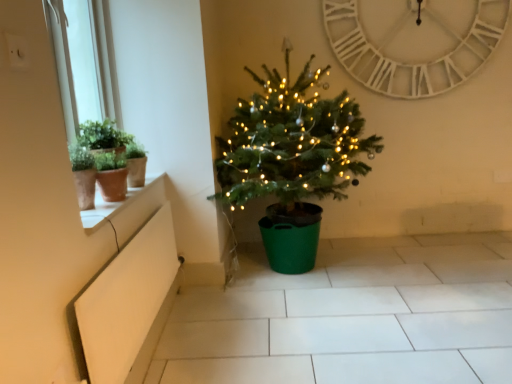
Question: Considering the relative sizes of green matte christmas tree at center and white glossy window sill at upper left in the image provided, is green matte christmas tree at center smaller than white glossy window sill at upper left?

Choices:
 (A) yes
 (B) no

Answer: (B)

Question: Does green matte christmas tree at center have a greater height compared to white glossy window sill at upper left?

Choices:
 (A) yes
 (B) no

Answer: (A)

Question: Is green matte christmas tree at center oriented towards white glossy window sill at upper left?

Choices:
 (A) no
 (B) yes

Answer: (A)

Question: Considering the relative sizes of green matte christmas tree at center and white glossy window sill at upper left in the image provided, is green matte christmas tree at center wider than white glossy window sill at upper left?

Choices:
 (A) yes
 (B) no

Answer: (A)

Question: From a real-world perspective, is green matte christmas tree at center positioned under white glossy window sill at upper left based on gravity?

Choices:
 (A) no
 (B) yes

Answer: (A)

Question: In the image, is white glossy window sill at upper left on the left side or the right side of white matte window box at lower left?

Choices:
 (A) right
 (B) left

Answer: (B)

Question: Is white glossy window sill at upper left wider or thinner than white matte window box at lower left?

Choices:
 (A) wide
 (B) thin

Answer: (A)

Question: Is point (151, 180) closer or farther from the camera than point (93, 369)?

Choices:
 (A) farther
 (B) closer

Answer: (A)

Question: From a real-world perspective, is white glossy window sill at upper left above or below white matte window box at lower left?

Choices:
 (A) below
 (B) above

Answer: (B)

Question: Is white wooden clock at upper center taller or shorter than white glossy window sill at upper left?

Choices:
 (A) short
 (B) tall

Answer: (B)

Question: From a real-world perspective, is white wooden clock at upper center positioned above or below white glossy window sill at upper left?

Choices:
 (A) below
 (B) above

Answer: (B)

Question: From the image's perspective, is white wooden clock at upper center above or below white glossy window sill at upper left?

Choices:
 (A) below
 (B) above

Answer: (B)

Question: Is point (357, 54) closer or farther from the camera than point (124, 205)?

Choices:
 (A) closer
 (B) farther

Answer: (B)

Question: Is white wooden clock at upper center spatially inside green matte christmas tree at center, or outside of it?

Choices:
 (A) inside
 (B) outside

Answer: (B)

Question: From a real-world perspective, is white wooden clock at upper center physically located above or below green matte christmas tree at center?

Choices:
 (A) below
 (B) above

Answer: (B)